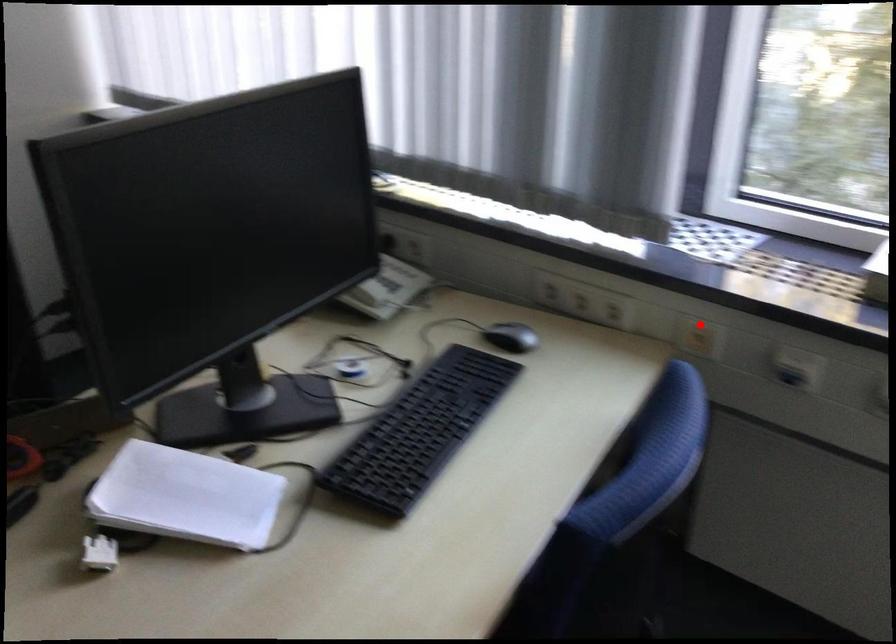
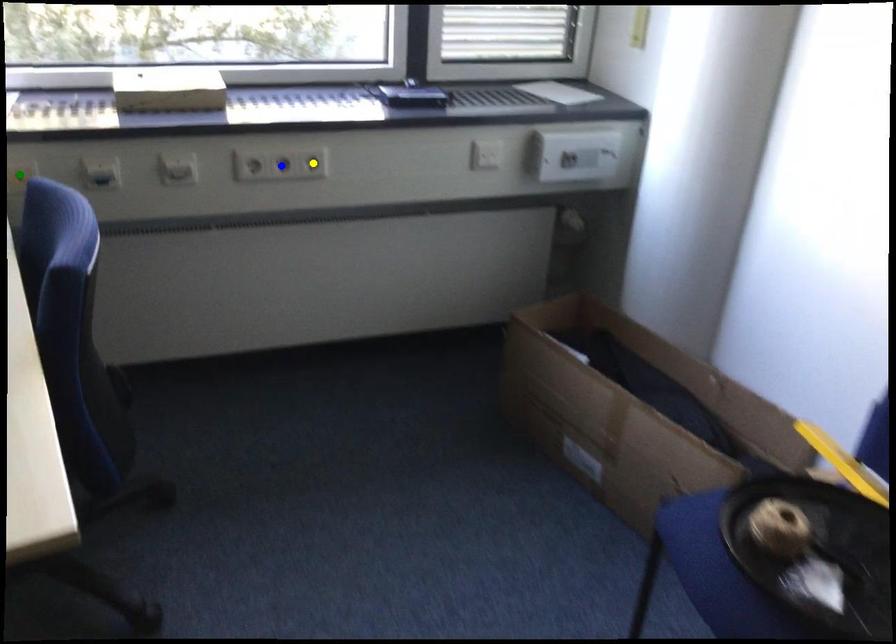
Question: I am providing you with two images of the same scene from different viewpoints. A red point is marked on the first image. You are given multiple points on the second image. Which point in image 2 represents the same 3d spot as the red point in image 1?

Choices:
 (A) blue point
 (B) yellow point
 (C) green point

Answer: (C)